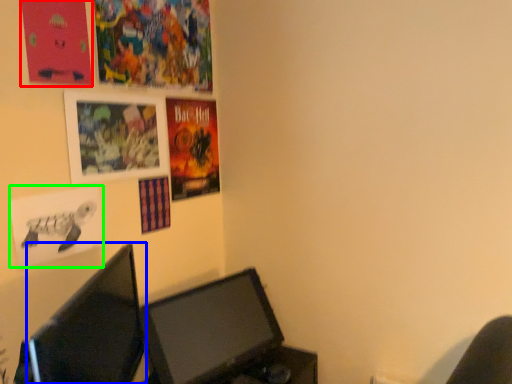
Question: Which object is the closest to the poster page (highlighted by a red box)? Choose among these: computer monitor (highlighted by a blue box) or poster page (highlighted by a green box).

Choices:
 (A) computer monitor
 (B) poster page

Answer: (B)